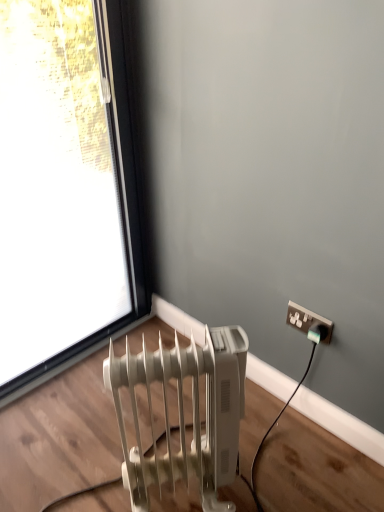
What do you see at coordinates (183, 413) in the screenshot?
I see `white plastic radiator at lower left` at bounding box center [183, 413].

This screenshot has width=384, height=512. Find the location of `transparent glass window at upper left`. transparent glass window at upper left is located at coordinates tap(64, 185).

Find the location of `white plastic radiator at lower left`. white plastic radiator at lower left is located at coordinates (183, 413).

From the image's perspective, which object appears higher, white plastic power plugs and sockets at upper right or transparent glass window at upper left?

transparent glass window at upper left, from the image's perspective.

Where is `power plugs and sockets below the transparent glass window at upper left (from a real-world perspective)`? power plugs and sockets below the transparent glass window at upper left (from a real-world perspective) is located at coordinates (307, 320).

Which is more to the right, white plastic power plugs and sockets at upper right or transparent glass window at upper left?

From the viewer's perspective, white plastic power plugs and sockets at upper right appears more on the right side.

Considering the positions of points (311, 319) and (118, 77), is point (311, 319) closer to camera compared to point (118, 77)?

Yes, point (311, 319) is in front of point (118, 77).

Does white plastic power plugs and sockets at upper right have a lesser height compared to white plastic radiator at lower left?

Indeed, white plastic power plugs and sockets at upper right has a lesser height compared to white plastic radiator at lower left.

In the scene shown: Is white plastic power plugs and sockets at upper right looking in the opposite direction of white plastic radiator at lower left?

white plastic power plugs and sockets at upper right does not have its back to white plastic radiator at lower left.

From a real-world perspective, is white plastic power plugs and sockets at upper right under white plastic radiator at lower left?

No, from a real-world perspective, white plastic power plugs and sockets at upper right is not under white plastic radiator at lower left.

Is white plastic power plugs and sockets at upper right spatially inside white plastic radiator at lower left, or outside of it?

white plastic power plugs and sockets at upper right is not inside white plastic radiator at lower left, it's outside.

Is white plastic radiator at lower left at the right side of transparent glass window at upper left?

Yes.

Locate an element on the screen. This screenshot has width=384, height=512. radiator in front of the transparent glass window at upper left is located at coordinates (183, 413).

From a real-world perspective, is white plastic radiator at lower left above or below transparent glass window at upper left?

Clearly, from a real-world perspective, white plastic radiator at lower left is below transparent glass window at upper left.

Does transparent glass window at upper left have a greater height compared to white plastic radiator at lower left?

Correct, transparent glass window at upper left is much taller as white plastic radiator at lower left.

Does point (15, 67) appear closer or farther from the camera than point (229, 443)?

Point (15, 67) is farther from the camera than point (229, 443).

Is transparent glass window at upper left not near white plastic radiator at lower left?

That's not correct — transparent glass window at upper left is a little close to white plastic radiator at lower left.

How many degrees apart are the facing directions of transparent glass window at upper left and white plastic radiator at lower left?

The angle between the facing direction of transparent glass window at upper left and the facing direction of white plastic radiator at lower left is 32.1 degrees.

Is transparent glass window at upper left touching white plastic power plugs and sockets at upper right?

There is a gap between transparent glass window at upper left and white plastic power plugs and sockets at upper right.

Which of these two, transparent glass window at upper left or white plastic power plugs and sockets at upper right, is smaller?

With smaller size is white plastic power plugs and sockets at upper right.

Would you say transparent glass window at upper left is inside or outside white plastic power plugs and sockets at upper right?

transparent glass window at upper left is not inside white plastic power plugs and sockets at upper right, it's outside.

Can you tell me how much white plastic radiator at lower left and white plastic power plugs and sockets at upper right differ in facing direction?

They differ by 57.4 degrees in their facing directions.

Looking at this image, considering the sizes of objects white plastic radiator at lower left and white plastic power plugs and sockets at upper right in the image provided, who is thinner, white plastic radiator at lower left or white plastic power plugs and sockets at upper right?

white plastic power plugs and sockets at upper right.

Who is bigger, white plastic radiator at lower left or white plastic power plugs and sockets at upper right?

white plastic radiator at lower left is bigger.

From a real-world perspective, is white plastic radiator at lower left located higher than white plastic power plugs and sockets at upper right?

No, from a real-world perspective, white plastic radiator at lower left is not on top of white plastic power plugs and sockets at upper right.

What are the coordinates of `window above the white plastic power plugs and sockets at upper right (from a real-world perspective)` in the screenshot? It's located at (64, 185).

Identify the location of radiator below the white plastic power plugs and sockets at upper right (from the image's perspective). (183, 413).

Looking at the image, which one is located further to white plastic power plugs and sockets at upper right, transparent glass window at upper left or white plastic radiator at lower left?

Based on the image, transparent glass window at upper left appears to be further to white plastic power plugs and sockets at upper right.

Looking at the image, which one is located closer to white plastic radiator at lower left, white plastic power plugs and sockets at upper right or transparent glass window at upper left?

white plastic power plugs and sockets at upper right is closer to white plastic radiator at lower left.

From the picture: Which object lies nearer to the anchor point transparent glass window at upper left, white plastic power plugs and sockets at upper right or white plastic radiator at lower left?

white plastic radiator at lower left is closer to transparent glass window at upper left.

From the image, which object appears to be farther from white plastic radiator at lower left, transparent glass window at upper left or white plastic power plugs and sockets at upper right?

transparent glass window at upper left lies further to white plastic radiator at lower left than the other object.

In the scene shown: When comparing their distances from transparent glass window at upper left, does white plastic radiator at lower left or white plastic power plugs and sockets at upper right seem further?

white plastic power plugs and sockets at upper right is further to transparent glass window at upper left.

From the image, which object appears to be nearer to white plastic power plugs and sockets at upper right, white plastic radiator at lower left or transparent glass window at upper left?

Based on the image, white plastic radiator at lower left appears to be nearer to white plastic power plugs and sockets at upper right.

Find the location of a particular element. The height and width of the screenshot is (512, 384). radiator between transparent glass window at upper left and white plastic power plugs and sockets at upper right from left to right is located at coordinates (183, 413).